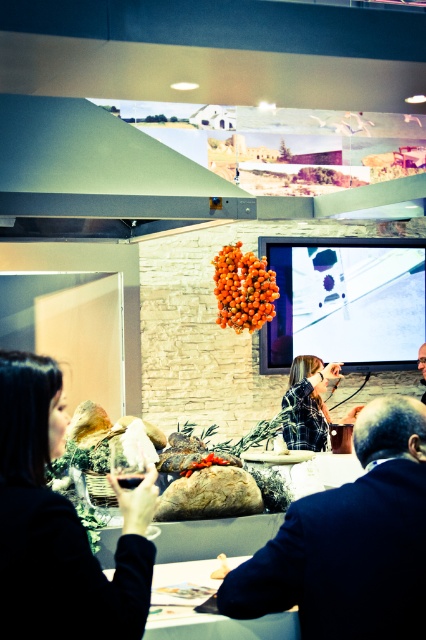
Question: Is matte green exhaust hood at upper center behind matte black screen at upper center?

Choices:
 (A) no
 (B) yes

Answer: (A)

Question: Does smooth wooden table at lower center have a smaller size compared to orange matte cluster at center?

Choices:
 (A) yes
 (B) no

Answer: (A)

Question: Which point is farther to the camera?

Choices:
 (A) (250, 324)
 (B) (294, 435)
 (C) (342, 360)

Answer: (C)

Question: Among these objects, which one is farthest from the camera?

Choices:
 (A) smooth wooden table at lower center
 (B) matte black screen at upper center
 (C) dark blue suit at center

Answer: (B)

Question: Can you confirm if matte black wine glass at lower left is wider than matte green exhaust hood at upper center?

Choices:
 (A) yes
 (B) no

Answer: (B)

Question: Which point is closer to the camera taking this photo?

Choices:
 (A) (293, 401)
 (B) (221, 260)
 (C) (348, 323)

Answer: (A)